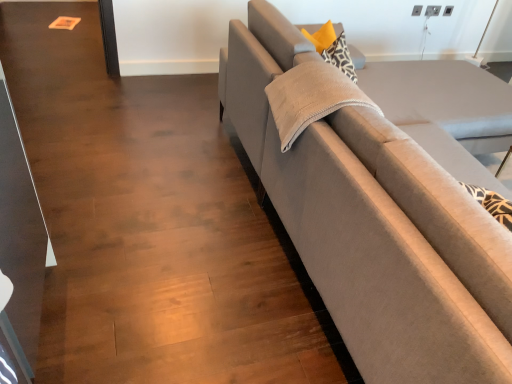
Measure the distance between point (269, 156) and camera.

The distance of point (269, 156) from camera is 1.84 meters.

Identify the location of light gray fabric couch at right. (381, 215).

What do you see at coordinates (381, 215) in the screenshot? This screenshot has width=512, height=384. I see `light gray fabric couch at right` at bounding box center [381, 215].

I want to click on light gray fabric couch at right, so click(381, 215).